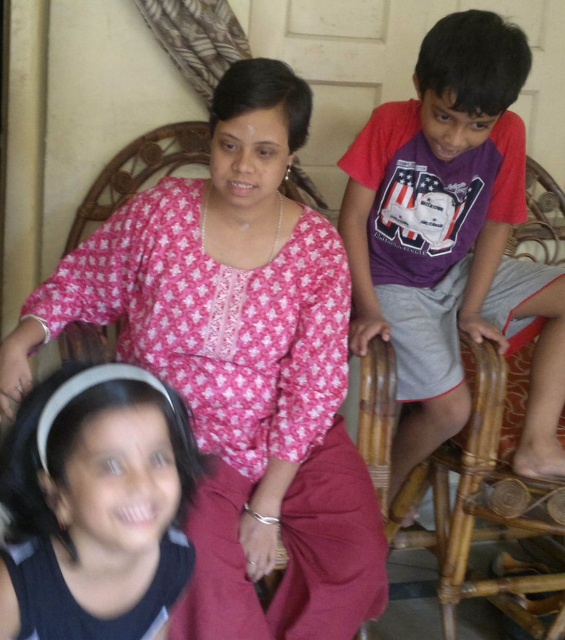
Question: Is pink printed blouse at center closer to the viewer compared to black matte hairband at lower left?

Choices:
 (A) no
 (B) yes

Answer: (A)

Question: Which object is the closest to the black matte hairband at lower left?

Choices:
 (A) pink printed blouse at center
 (B) purple cotton shirt at right

Answer: (A)

Question: In this image, where is pink printed blouse at center located relative to purple cotton shirt at right?

Choices:
 (A) left
 (B) right

Answer: (A)

Question: Among these objects, which one is farthest from the camera?

Choices:
 (A) purple cotton shirt at right
 (B) black matte hairband at lower left
 (C) pink printed blouse at center

Answer: (A)

Question: Which is farther from the purple cotton shirt at right?

Choices:
 (A) pink printed blouse at center
 (B) black matte hairband at lower left

Answer: (B)

Question: Does pink printed blouse at center appear on the left side of black matte hairband at lower left?

Choices:
 (A) no
 (B) yes

Answer: (A)